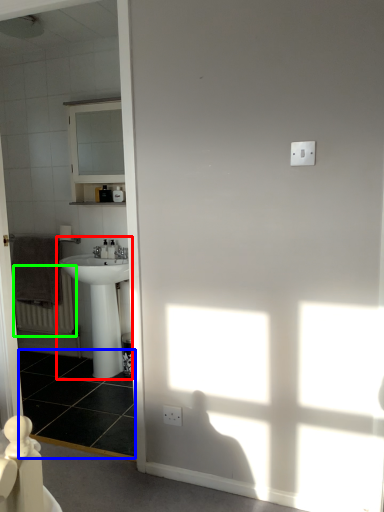
Question: Considering the real-world distances, which object is farthest from sink (highlighted by a red box)? tile (highlighted by a blue box) or radiator (highlighted by a green box)?

Choices:
 (A) tile
 (B) radiator

Answer: (B)